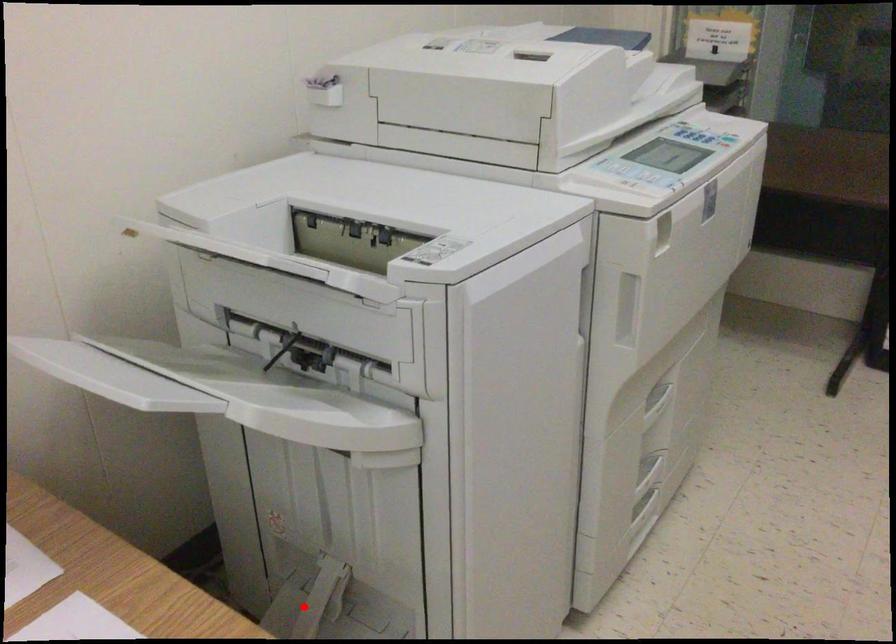
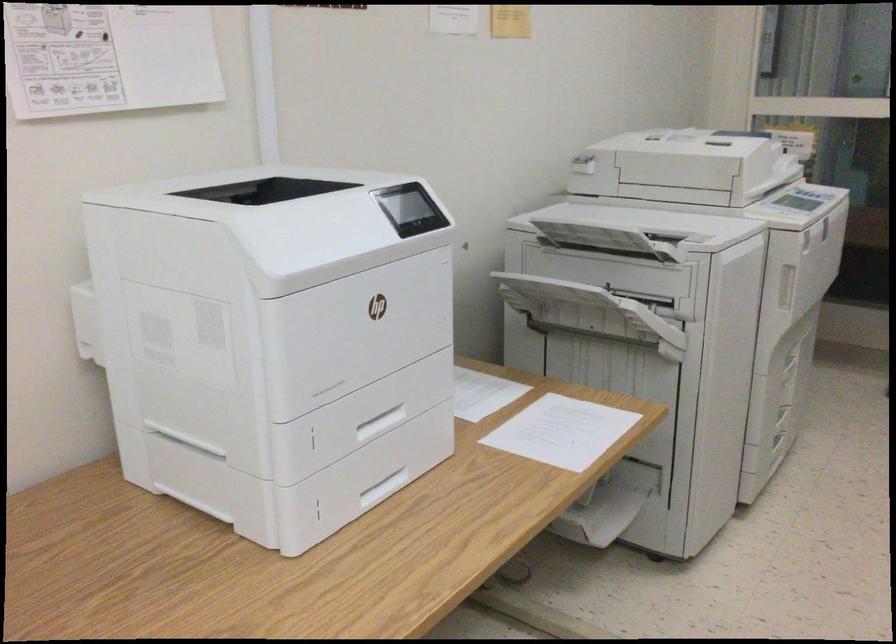
Question: I am providing you with two images of the same scene from different viewpoints. A red point is marked on the first image. Can you still see the location of the red point in image 2?

Choices:
 (A) Yes
 (B) No

Answer: (B)